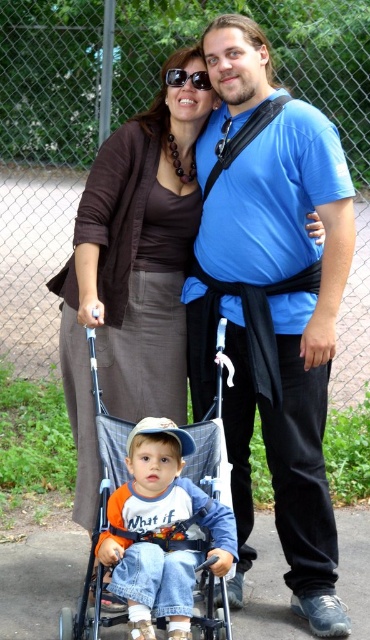
You are a delivery person who needs to place a package between the blue fabric stroller at center and the sunglasses at center. The package requires 2 meters of space. Can you fit it between them?

The blue fabric stroller at center and sunglasses at center are 1.86 meters apart from each other. Since the required space for the package is 2 meters, which is longer than the available space, the package cannot be placed between them.

You are a photographer trying to capture a candid shot of the child in the stroller. You have a camera with a wide lens that can focus on objects at the center. Since the blue cotton shirt at center and the sunglasses at center are both at the center, which one should you focus on to ensure the child is in the frame?

The blue cotton shirt at center is positioned on the right side of sunglasses at center, so focusing on the sunglasses at center would place the child more centrally in the frame since the shirt is shifted to the right.